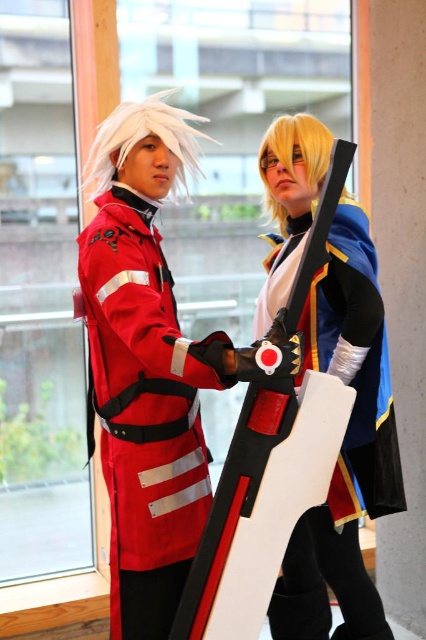
Question: Which object appears closest to the camera in this image?

Choices:
 (A) matte red uniform at center
 (B) matte red fabric uniform at left
 (C) shiny gold armor at center

Answer: (A)

Question: Which object appears closest to the camera in this image?

Choices:
 (A) matte red fabric uniform at left
 (B) shiny gold armor at center

Answer: (A)

Question: Can you confirm if matte red uniform at center is positioned below matte red fabric uniform at left?

Choices:
 (A) yes
 (B) no

Answer: (B)

Question: Is matte red fabric uniform at left wider than shiny gold armor at center?

Choices:
 (A) yes
 (B) no

Answer: (B)

Question: Among these objects, which one is nearest to the camera?

Choices:
 (A) matte red uniform at center
 (B) matte red fabric uniform at left

Answer: (A)

Question: Is matte red fabric uniform at left above shiny gold armor at center?

Choices:
 (A) no
 (B) yes

Answer: (A)